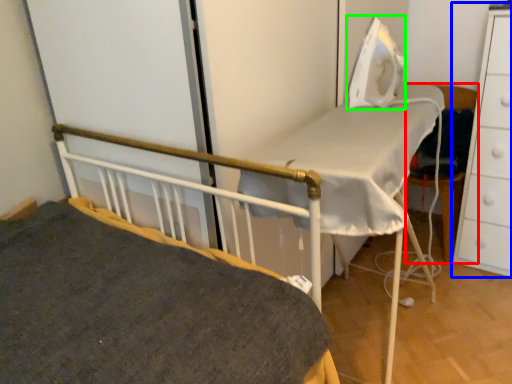
Question: Considering the real-world distances, which object is closest to chair (highlighted by a red box)? chest of drawers (highlighted by a blue box) or equipment (highlighted by a green box).

Choices:
 (A) chest of drawers
 (B) equipment

Answer: (A)